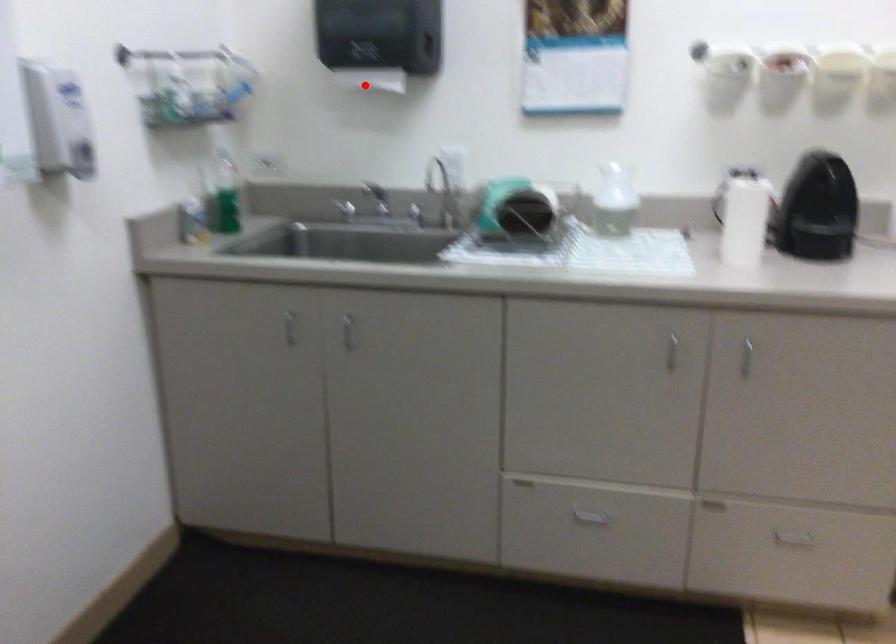
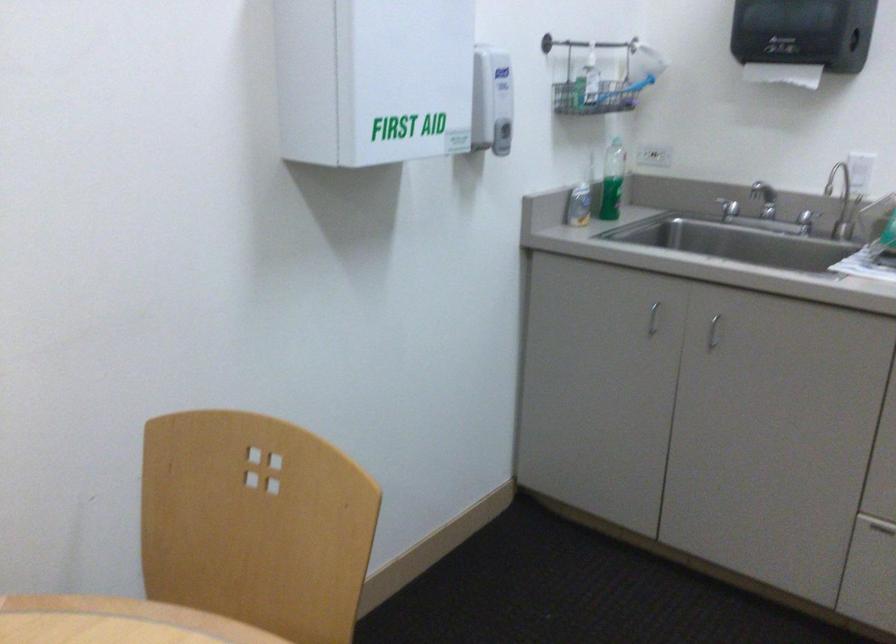
In the second image, find the point that corresponds to the highlighted location in the first image.

(782, 73)